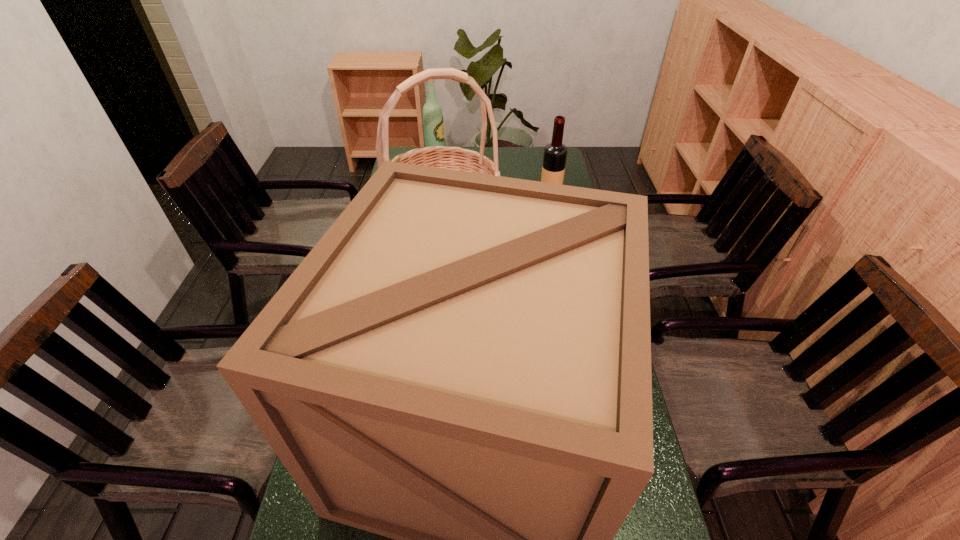
Find the location of a particular element. This screenshot has width=960, height=540. wine bottle that is at the left edge is located at coordinates (433, 122).

I want to click on object present at the right edge, so click(x=555, y=153).

Locate an element on the screen. This screenshot has height=540, width=960. object at the far left corner is located at coordinates (433, 122).

At what (x,y) coordinates should I click in order to perform the action: click on blank area at the far edge. Please return your answer as a coordinate pair (x, y). This screenshot has height=540, width=960. Looking at the image, I should click on (519, 155).

Find the location of a particular element. This screenshot has width=960, height=540. free space at the right edge of the desktop is located at coordinates (566, 180).

Where is `object that ranks as the third closest to the second nearest object`? This screenshot has width=960, height=540. object that ranks as the third closest to the second nearest object is located at coordinates (433, 122).

The image size is (960, 540). In order to click on object that ranks as the second closest to the second farthest object in this screenshot , I will do `click(433, 122)`.

Where is `free space that satisfies the following two spatial constraints: 1. on the back side of the nearer wine bottle; 2. on the front-facing side of the farther wine bottle`? free space that satisfies the following two spatial constraints: 1. on the back side of the nearer wine bottle; 2. on the front-facing side of the farther wine bottle is located at coordinates (542, 164).

Find the location of a particular element. The width and height of the screenshot is (960, 540). vacant space that satisfies the following two spatial constraints: 1. on the front-facing side of the nearer wine bottle; 2. on the left side of the farthest object is located at coordinates (431, 201).

Locate an element on the screen. The height and width of the screenshot is (540, 960). free spot that satisfies the following two spatial constraints: 1. on the back side of the third farthest object; 2. on the right side of the third nearest object is located at coordinates click(x=446, y=201).